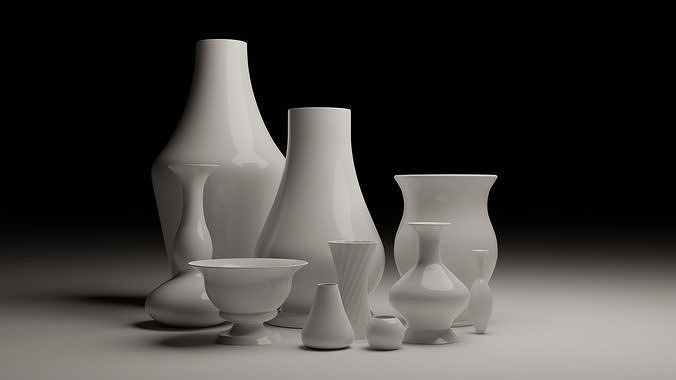
Where is `3 thin vases`? Image resolution: width=676 pixels, height=380 pixels. 3 thin vases is located at coordinates (199, 226), (487, 303), (349, 272).